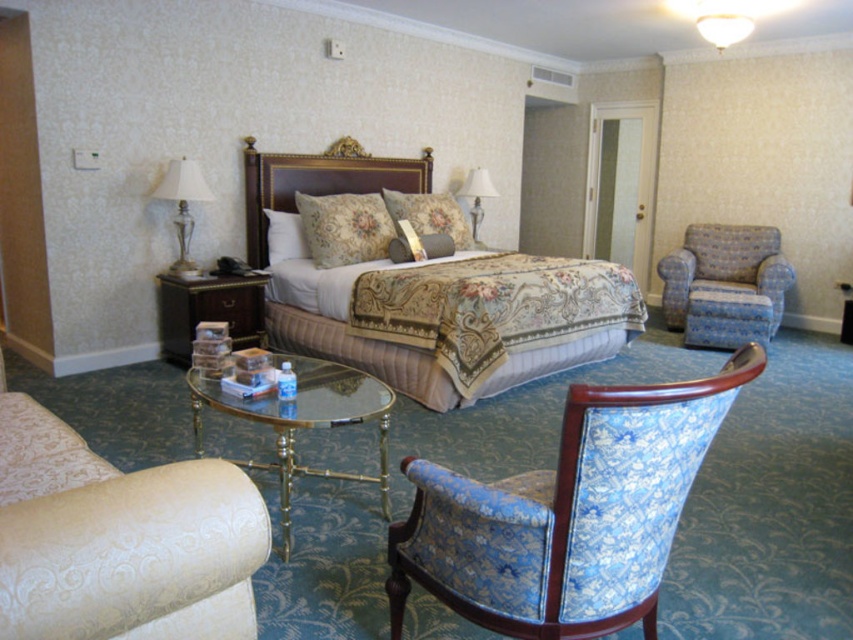
The width and height of the screenshot is (853, 640). What do you see at coordinates (567, 515) in the screenshot?
I see `blue floral fabric swivel chair at lower right` at bounding box center [567, 515].

Which is below, blue floral fabric swivel chair at lower right or floral fabric pillow at center?

blue floral fabric swivel chair at lower right is lower down.

Who is more forward, (618, 403) or (300, 209)?

Point (618, 403) is in front.

Identify the location of blue floral fabric swivel chair at lower right. (567, 515).

Is gold-patterned fabric bed at center thinner than fluffy white pillow at center?

No, gold-patterned fabric bed at center is not thinner than fluffy white pillow at center.

Who is more forward, (514, 384) or (283, 221)?

Point (514, 384)

Is point (563, 349) behind point (277, 220)?

That is False.

In order to click on gold-patterned fabric bed at center in this screenshot , I will do `click(422, 284)`.

Who is positioned more to the left, blue floral fabric swivel chair at lower right or blue fabric swivel chair at right?

blue floral fabric swivel chair at lower right

Consider the image. Does blue floral fabric swivel chair at lower right appear under blue fabric swivel chair at right?

Correct, blue floral fabric swivel chair at lower right is located below blue fabric swivel chair at right.

The image size is (853, 640). What are the coordinates of `blue floral fabric swivel chair at lower right` in the screenshot? It's located at tap(567, 515).

I want to click on blue floral fabric swivel chair at lower right, so click(567, 515).